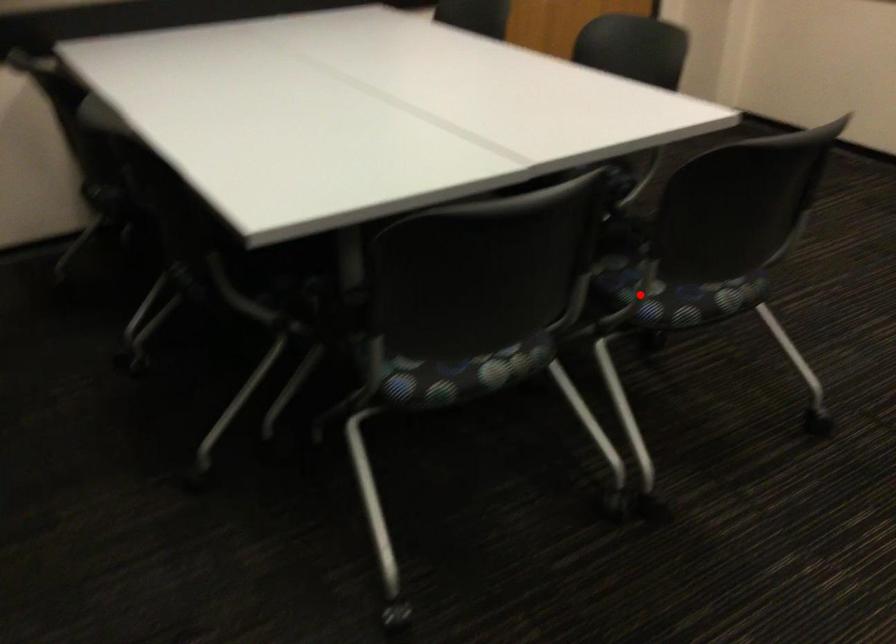
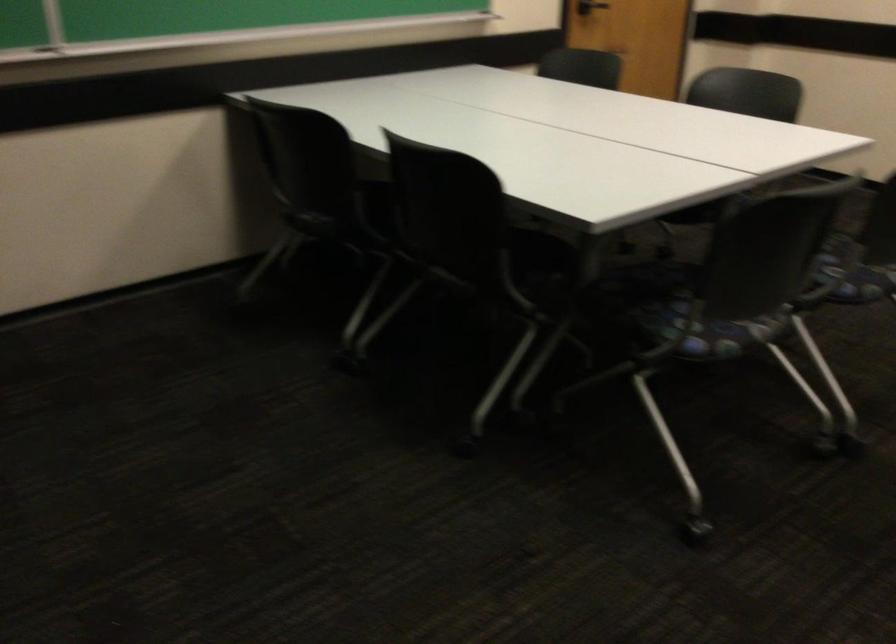
Question: I am providing you with two images of the same scene from different viewpoints. In image1, a red point is highlighted. Considering the same 3D point in image2, which of the following is correct?

Choices:
 (A) It is closer
 (B) It is farther

Answer: (B)